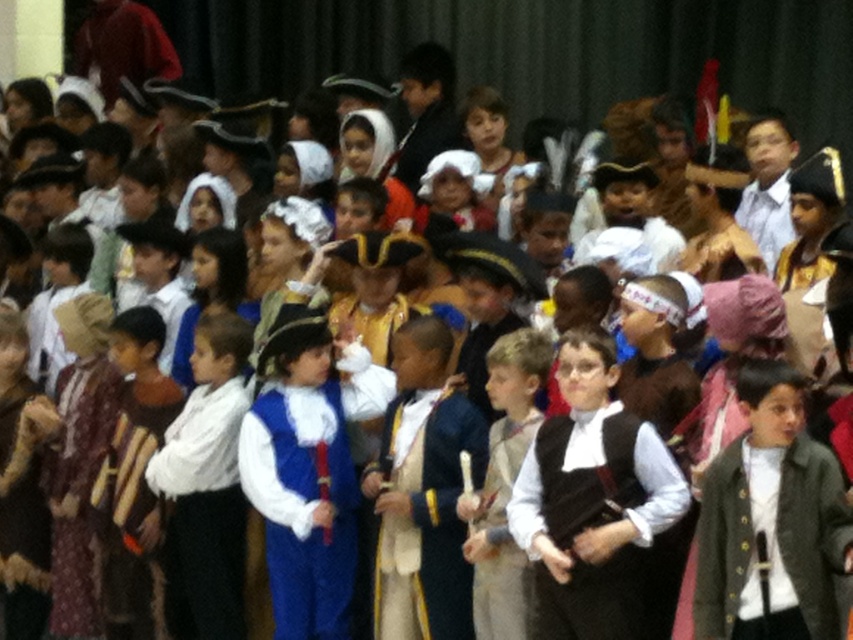
You are a costume designer who needs to adjust the positioning of the matte black vest at center and the blue velvet vest at center for a stage performance. The stage has a limited space of 4 meters between the two front rows. Can you place both vests within this distance without overlapping?

The distance between the matte black vest at center and the blue velvet vest at center is currently 4.32 meters. Since the stage allows only 4 meters between the two front rows, the vests cannot be placed within the required distance without overlapping.

You are a photographer taking a picture of the children in their costumes. You notice two points marked in the scene at coordinates point (x=602, y=522) and point (x=817, y=552). Which point is closer to your camera?

Point (x=602, y=522) is further to the camera than point (x=817, y=552), so the closer point to the camera is point (x=817, y=552).